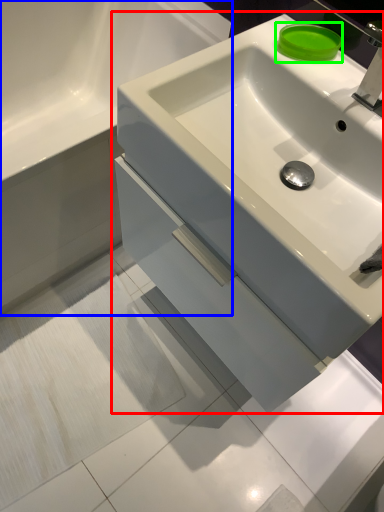
Question: Based on their relative distances, which object is nearer to sink (highlighted by a red box)? Choose from bathroom cabinet (highlighted by a blue box) and soap (highlighted by a green box).

Choices:
 (A) bathroom cabinet
 (B) soap

Answer: (B)